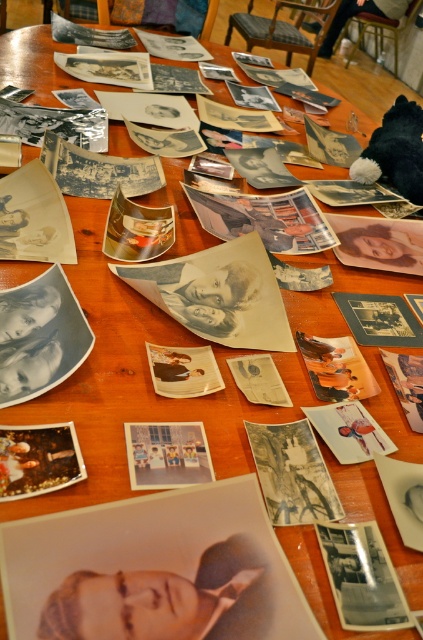
You are standing in front of the table with old photographs. You need to place a small sticker on the point that is closer to you. Which point should you choose between the point at (250,538) and the point at (282,346)?

You should place the sticker on point (250,538) because it is closer to the viewer than point (282,346) according to the description.

You are holding a camera and want to take a closeup shot of the matte paper portrait at center. The camera requires the subject to be within 18 inches to focus properly. Can you take the photo without moving the portrait?

The matte paper portrait at center is 20.60 inches from camera. Since the camera requires the subject to be within 18 inches to focus properly, you cannot take the photo without moving the portrait closer.

You are organizing a photo album and have two photos on your desk. You need to place them side by side in the album. The matte paper portrait at center and the matte paper photo at center are both on the table. Which one will take up less space when placed in the album?

The matte paper portrait at center occupies less space than the matte paper photo at center, so it will take up less space when placed in the album.